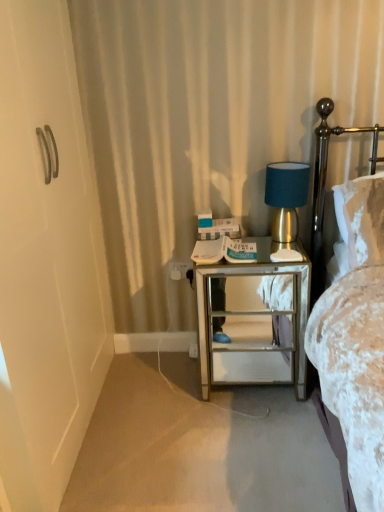
Question: Is carpet at lower left thinner than gold metallic table lamp at right?

Choices:
 (A) yes
 (B) no

Answer: (B)

Question: From the image's perspective, would you say carpet at lower left is positioned over gold metallic table lamp at right?

Choices:
 (A) yes
 (B) no

Answer: (B)

Question: Could you tell me if carpet at lower left is turned towards gold metallic table lamp at right?

Choices:
 (A) yes
 (B) no

Answer: (B)

Question: Can you confirm if carpet at lower left is positioned to the right of gold metallic table lamp at right?

Choices:
 (A) no
 (B) yes

Answer: (A)

Question: Is carpet at lower left positioned before gold metallic table lamp at right?

Choices:
 (A) yes
 (B) no

Answer: (A)

Question: Does point (306, 265) appear closer or farther from the camera than point (317, 183)?

Choices:
 (A) closer
 (B) farther

Answer: (B)

Question: From the image's perspective, relative to gold metallic headboard at right, is clear glass nightstand at center above or below?

Choices:
 (A) above
 (B) below

Answer: (B)

Question: Choose the correct answer: Is clear glass nightstand at center inside gold metallic headboard at right or outside it?

Choices:
 (A) outside
 (B) inside

Answer: (A)

Question: Is clear glass nightstand at center taller or shorter than gold metallic headboard at right?

Choices:
 (A) short
 (B) tall

Answer: (B)

Question: Is gold metallic headboard at right in front of or behind carpet at lower left in the image?

Choices:
 (A) behind
 (B) front

Answer: (A)

Question: From their relative heights in the image, would you say gold metallic headboard at right is taller or shorter than carpet at lower left?

Choices:
 (A) tall
 (B) short

Answer: (A)

Question: Is point (375, 150) closer or farther from the camera than point (294, 398)?

Choices:
 (A) closer
 (B) farther

Answer: (B)

Question: From the image's perspective, is gold metallic headboard at right positioned above or below carpet at lower left?

Choices:
 (A) above
 (B) below

Answer: (A)

Question: Relative to white plastic electric outlet at center, is gold metallic headboard at right in front or behind?

Choices:
 (A) behind
 (B) front

Answer: (B)

Question: Is point (319, 134) positioned closer to the camera than point (170, 268)?

Choices:
 (A) closer
 (B) farther

Answer: (A)